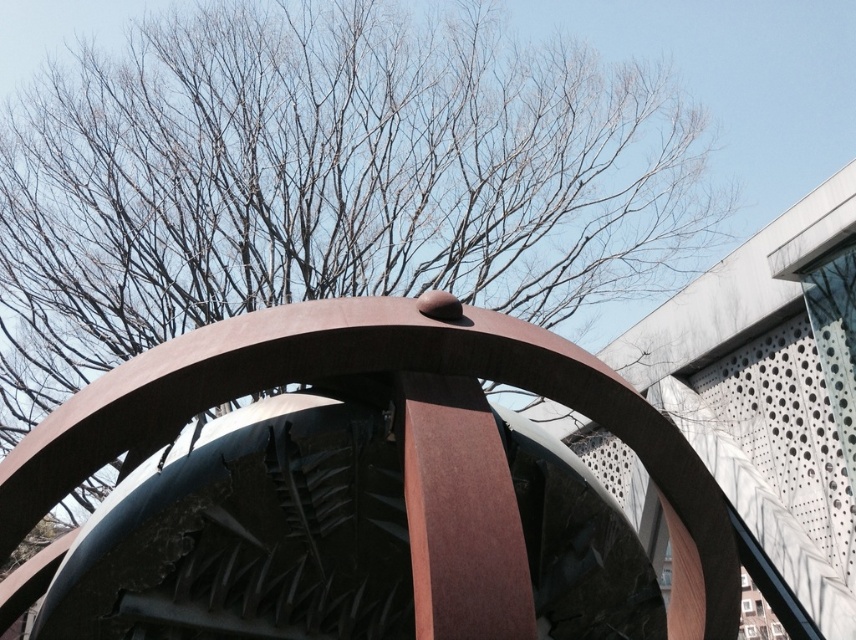
Question: Among these points, which one is nearest to the camera?

Choices:
 (A) (700, 531)
 (B) (476, 300)

Answer: (A)

Question: Among these points, which one is farthest from the camera?

Choices:
 (A) (485, 570)
 (B) (474, 150)

Answer: (B)

Question: Does brown leafless tree at upper center have a greater width compared to rusty metal sculpture at center?

Choices:
 (A) yes
 (B) no

Answer: (A)

Question: Where is brown leafless tree at upper center located in relation to rusty metal sculpture at center in the image?

Choices:
 (A) below
 (B) above

Answer: (B)

Question: Which of the following is the closest to the observer?

Choices:
 (A) (698, 592)
 (B) (27, 321)

Answer: (A)

Question: Does brown leafless tree at upper center have a larger size compared to rusty metal sculpture at center?

Choices:
 (A) yes
 (B) no

Answer: (A)